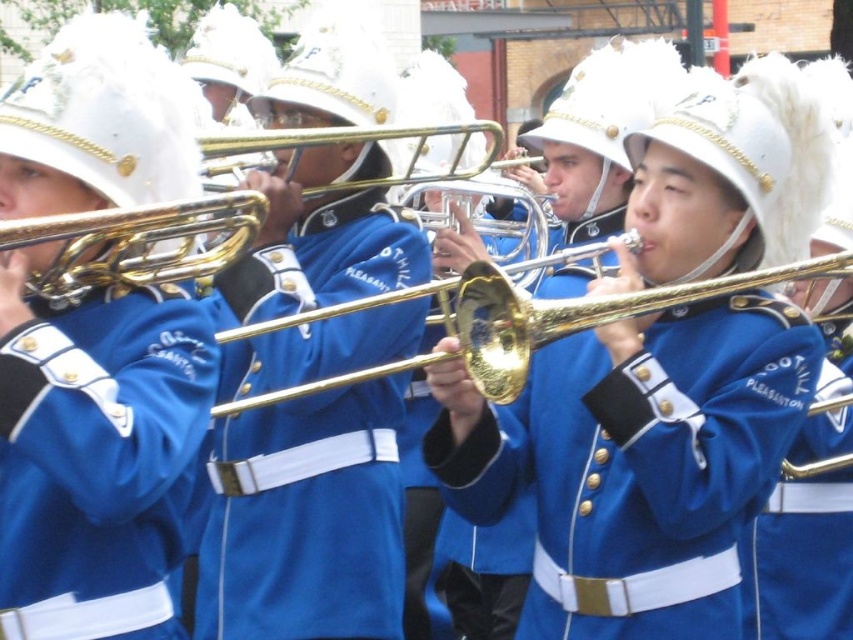
Question: Estimate the real-world distances between objects in this image. Which object is farther from the matte gold trombone at center?

Choices:
 (A) blue cotton jacket at center
 (B) gold polished trombone at center
 (C) gold brass trombone at center
 (D) gold brass trumpet at center

Answer: (A)

Question: Can you confirm if blue cotton jacket at center is wider than gold brass trombone at center?

Choices:
 (A) yes
 (B) no

Answer: (B)

Question: Does gold polished trombone at center appear on the left side of gold brass trumpet at center?

Choices:
 (A) no
 (B) yes

Answer: (A)

Question: Considering the real-world distances, which object is farthest from the gold brass trombone at center?

Choices:
 (A) blue glossy trombone at center
 (B) gold polished trombone at center
 (C) blue fabric uniform at center

Answer: (A)

Question: Which point is farther to the camera?

Choices:
 (A) (836, 390)
 (B) (299, 520)
 (C) (1, 490)
 (D) (97, 220)

Answer: (B)

Question: Is blue cotton jacket at center further to camera compared to gold brass trumpet at center?

Choices:
 (A) yes
 (B) no

Answer: (A)